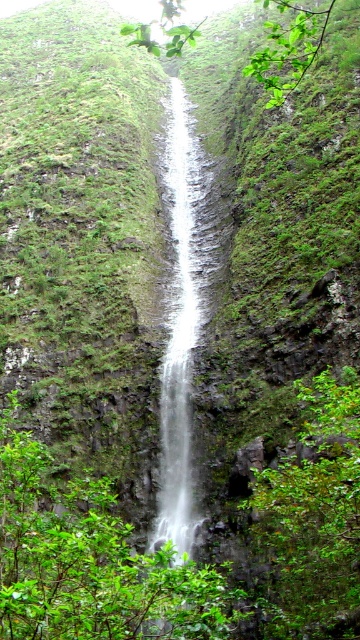
You are standing at the base of the waterfall and want to place a small bench for visitors to rest. The bench requires a clear space of 1 meter by 1 meter. Based on the scene description, is there enough space at the location of the green leafy shrubs at center to place the bench?

The green leafy shrubs at center are located at point (90, 561). Since the shrubs themselves occupy space, there may not be enough clear area to place a 1 meter by 1 meter bench there without disturbing the vegetation. It would be better to look for another spot with more open ground.

You are a hiker who wants to take a photo of the white smooth waterfall at center without any obstruction. Are the green leafy shrubs at center blocking your view of the waterfall?

The green leafy shrubs at center are shorter than the white smooth waterfall at center, so they won not block your view of the waterfall.